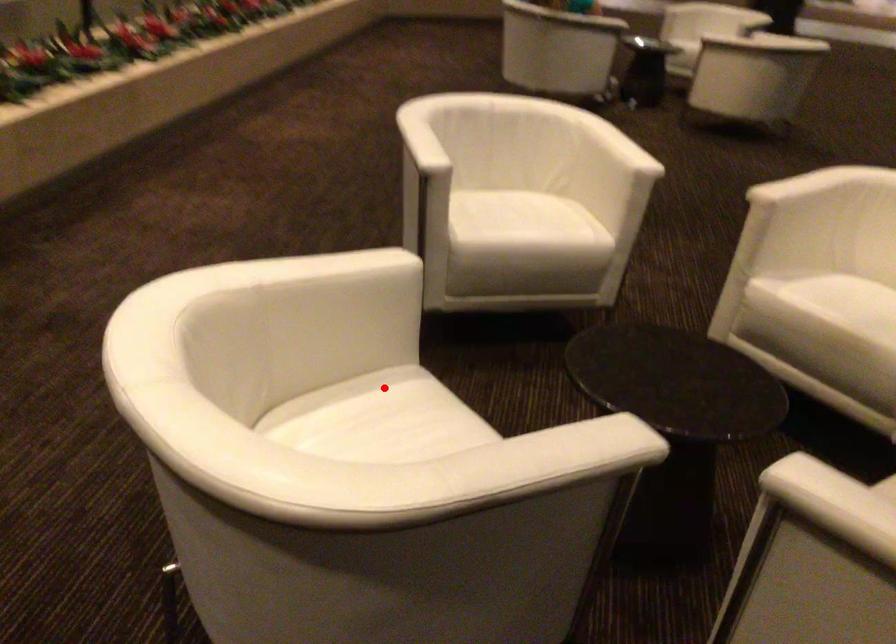
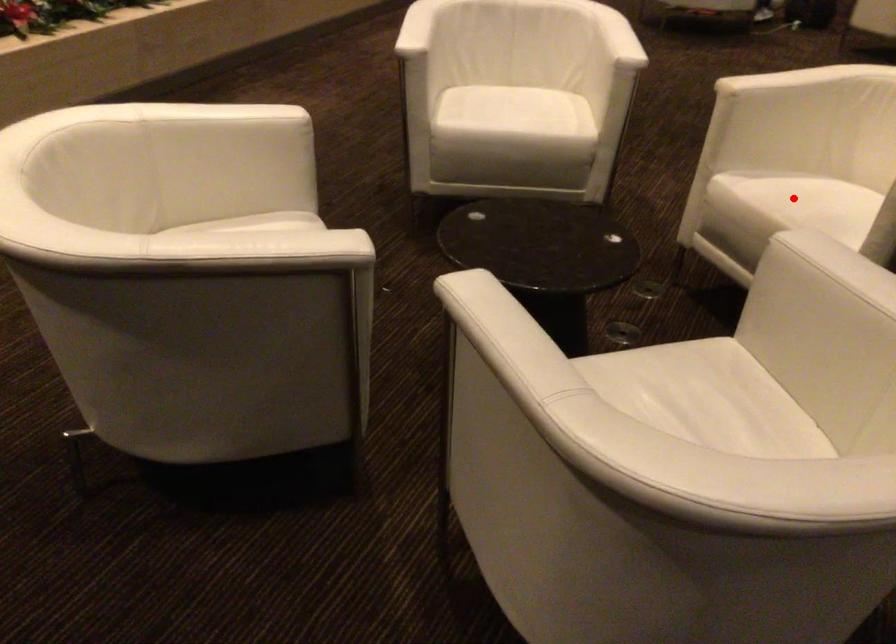
From the picture: I am providing you with two images of the same scene from different viewpoints. A red point is marked on the first image and another point is marked on the second image. Is the marked point in image1 the same physical position as the marked point in image2?

No